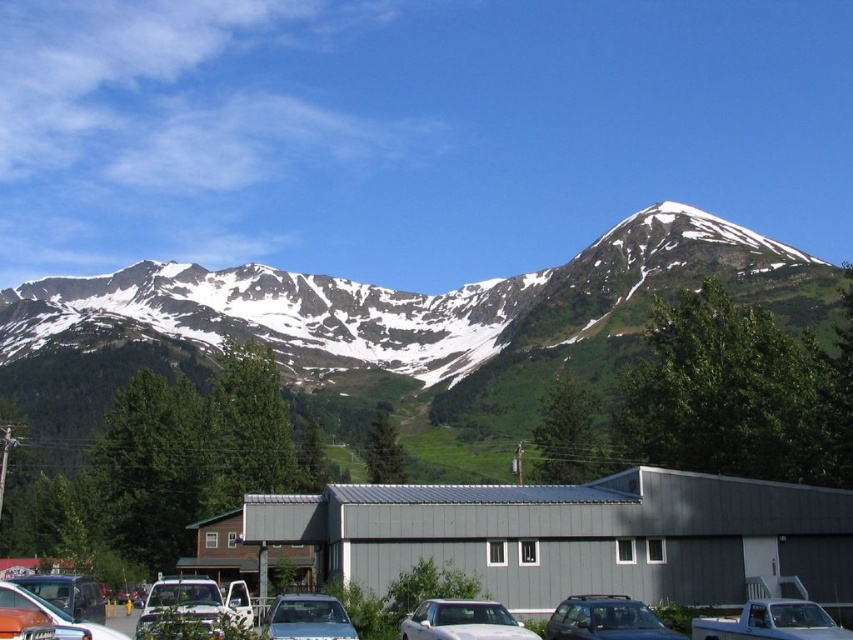
Based on the photo, is the position of metallic blue sedan at center less distant than that of metallic silver truck at lower left?

No, it is not.

You are a GUI agent. You are given a task and a screenshot of the screen. Output one action in this format:
    pyautogui.click(x=<x>, y=<y>)
    Task: Click on the metallic blue sedan at center
    The height and width of the screenshot is (640, 853).
    Given the screenshot: What is the action you would take?
    pyautogui.click(x=306, y=618)

Is point (294, 612) less distant than point (27, 593)?

No.

You are a GUI agent. You are given a task and a screenshot of the screen. Output one action in this format:
    pyautogui.click(x=<x>, y=<y>)
    Task: Click on the metallic blue sedan at center
    
    Given the screenshot: What is the action you would take?
    pyautogui.click(x=306, y=618)

Which of these two, white glossy sedan at center or metallic blue sedan at center, stands taller?

metallic blue sedan at center

The height and width of the screenshot is (640, 853). What do you see at coordinates (462, 621) in the screenshot?
I see `white glossy sedan at center` at bounding box center [462, 621].

Describe the element at coordinates (462, 621) in the screenshot. This screenshot has height=640, width=853. I see `white glossy sedan at center` at that location.

At what (x,y) coordinates should I click in order to perform the action: click on white glossy sedan at center. Please return your answer as a coordinate pair (x, y). This screenshot has height=640, width=853. Looking at the image, I should click on (462, 621).

Based on the photo, measure the distance between white glossy sedan at center and camera.

white glossy sedan at center is 70.49 meters away from camera.

What are the coordinates of `white glossy sedan at center` in the screenshot? It's located at (462, 621).